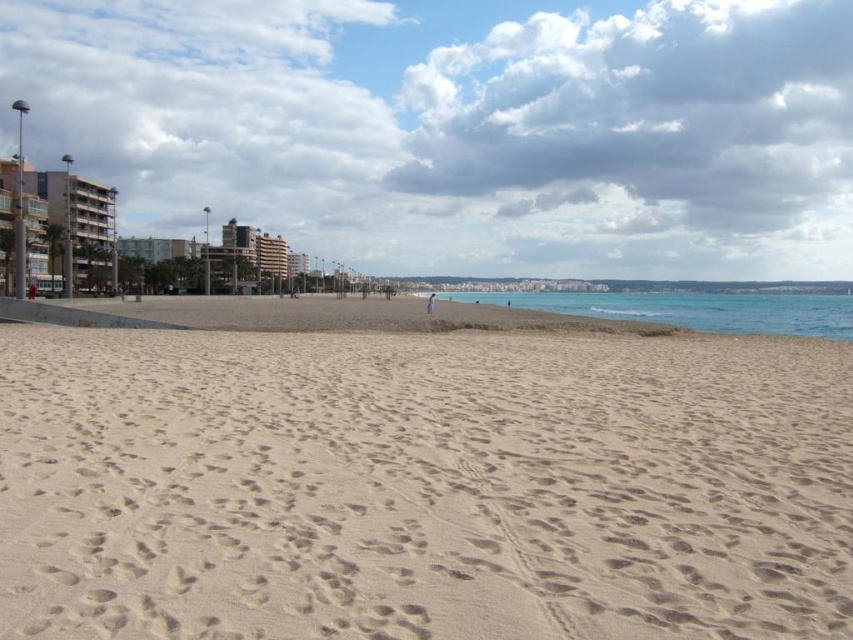
You are standing on the beach and want to take a photo of the green glass building at left and the light beige sand at center. Which object should you focus on first if you want to capture both in one shot without moving the camera?

You should focus on the light beige sand at center first because it is closer to you than the green glass building at left, so capturing it first will ensure both are in focus.

In the scene shown: You are standing at the origin point of the coordinate system. You want to walk to the light beige sand at center. Which direction should you go?

The light beige sand at center is located at coordinate point (422, 484), so you should move towards the right and slightly forward to reach it.

Looking at this image, you are standing on the beach and want to reach the point marked at coordinates (612, 536). If you walk straight towards it, how far will you have to walk?

The distance between you and the point marked at coordinates (612, 536) is 5.06 meters, so you will have to walk 5.06 meters to reach it.